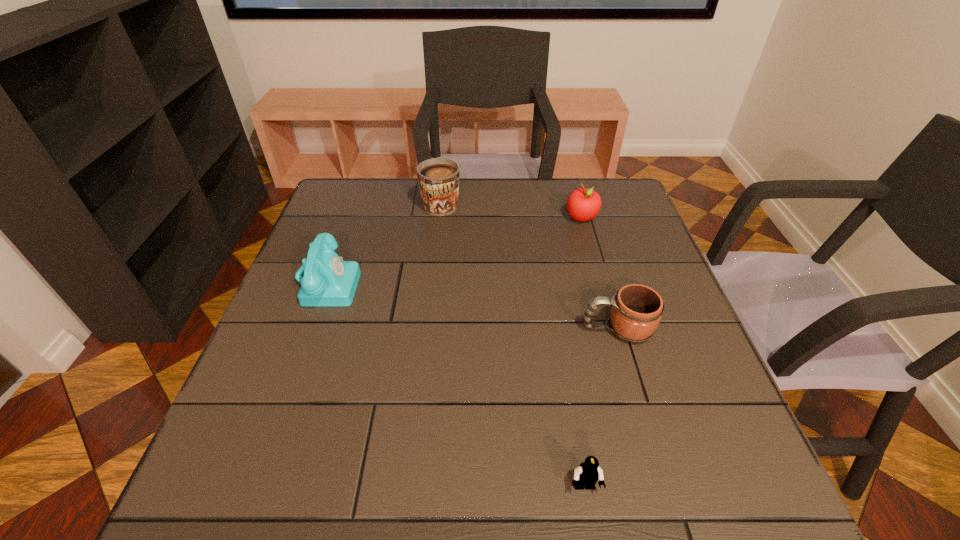
Where is `vacant area that lies between the Lego and the apple`? The height and width of the screenshot is (540, 960). vacant area that lies between the Lego and the apple is located at coordinates (583, 352).

The image size is (960, 540). What are the coordinates of `free space between the telephone and the third object from right to left` in the screenshot? It's located at (456, 384).

I want to click on vacant area between the right mug and the left mug, so (529, 265).

Image resolution: width=960 pixels, height=540 pixels. I want to click on vacant space in between the third object from right to left and the leftmost object, so click(456, 384).

This screenshot has width=960, height=540. I want to click on vacant area that lies between the farther mug and the apple, so click(512, 210).

Where is `empty location between the apple and the second object from left to right`? The image size is (960, 540). empty location between the apple and the second object from left to right is located at coordinates (512, 210).

Locate an element on the screen. free space between the Lego and the shorter mug is located at coordinates tap(601, 408).

Identify which object is the third closest to the apple. Please provide its 2D coordinates. Your answer should be formatted as a tuple, i.e. [(x, y)], where the tuple contains the x and y coordinates of a point satisfying the conditions above.

[(329, 281)]

The width and height of the screenshot is (960, 540). What are the coordinates of `object that is the third closest one to the right mug` in the screenshot? It's located at (438, 178).

You are a GUI agent. You are given a task and a screenshot of the screen. Output one action in this format:
    pyautogui.click(x=<x>, y=<y>)
    Task: Click on the vacant area in the image that satisfies the following two spatial constraints: 1. on the side of the right mug with the handle; 2. on the front-facing side of the nearest object
    The image size is (960, 540).
    Given the screenshot: What is the action you would take?
    pyautogui.click(x=663, y=487)